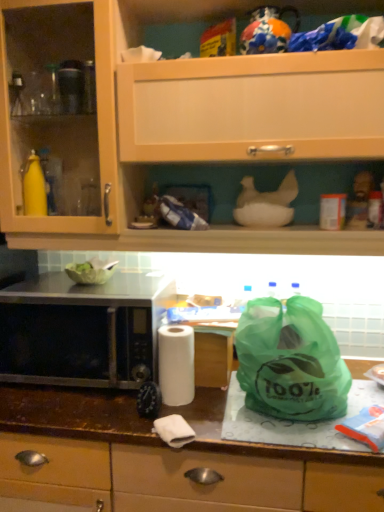
What do you see at coordinates (83, 329) in the screenshot?
I see `black matte microwave at left` at bounding box center [83, 329].

Identify the location of brown laminate countertop at center. This screenshot has height=512, width=384. (74, 415).

What do you see at coordinates (74, 415) in the screenshot? I see `brown laminate countertop at center` at bounding box center [74, 415].

The image size is (384, 512). What are the coordinates of `matte wood cabinet at upper center` in the screenshot? It's located at (183, 126).

Where is `black matte microwave at left`? Image resolution: width=384 pixels, height=512 pixels. black matte microwave at left is located at coordinates (83, 329).

In the scene shown: Is green plastic bag at right to the left of brown laminate countertop at center from the viewer's perspective?

No.

From the image's perspective, is green plastic bag at right positioned above or below brown laminate countertop at center?

Based on their image positions, green plastic bag at right is located above brown laminate countertop at center.

In the scene shown: Can brown laminate countertop at center be found inside green plastic bag at right?

No, brown laminate countertop at center is located outside of green plastic bag at right.

The image size is (384, 512). In order to click on plastic bag that is above the brown laminate countertop at center (from a real-world perspective) in this screenshot , I will do `click(290, 361)`.

In the scene shown: Is matte wood cabinet at upper center further to camera compared to white matte paper towel at center?

No, matte wood cabinet at upper center is closer to the viewer.

Can you confirm if matte wood cabinet at upper center is wider than white matte paper towel at center?

Indeed, matte wood cabinet at upper center has a greater width compared to white matte paper towel at center.

Is point (88, 37) closer to viewer compared to point (176, 361)?

No, (88, 37) is behind (176, 361).

Which of these two, brown laminate countertop at center or green plastic bag at right, is wider?

Wider between the two is brown laminate countertop at center.

Identify the location of countertop below the green plastic bag at right (from the image's perspective). (74, 415).

How far apart are brown laminate countertop at center and green plastic bag at right?

A distance of 9.55 inches exists between brown laminate countertop at center and green plastic bag at right.

Is brown laminate countertop at center facing towards green plastic bag at right?

No, brown laminate countertop at center is not turned towards green plastic bag at right.

How far apart are black matte microwave at left and white matte paper towel at center?

A distance of 8.87 inches exists between black matte microwave at left and white matte paper towel at center.

Is black matte microwave at left completely or partially outside of white matte paper towel at center?

Yes.

Can you tell me how much black matte microwave at left and white matte paper towel at center differ in facing direction?

The angle between the facing direction of black matte microwave at left and the facing direction of white matte paper towel at center is 4.79 degrees.

Looking at this image, are black matte microwave at left and white matte paper towel at center far apart?

No, there isn't a large distance between black matte microwave at left and white matte paper towel at center.

Is green plastic bag at right placed right next to matte wood cabinet at upper center?

No, green plastic bag at right is not beside matte wood cabinet at upper center.

Can you confirm if green plastic bag at right is taller than matte wood cabinet at upper center?

No.

From a real-world perspective, who is located higher, green plastic bag at right or matte wood cabinet at upper center?

matte wood cabinet at upper center.

Is green plastic bag at right at the right side of matte wood cabinet at upper center?

Yes.

Considering the sizes of objects black matte microwave at left and matte wood cabinet at upper center in the image provided, who is wider, black matte microwave at left or matte wood cabinet at upper center?

black matte microwave at left is wider.

Is black matte microwave at left positioned beyond the bounds of matte wood cabinet at upper center?

Yes, black matte microwave at left is not within matte wood cabinet at upper center.

Between black matte microwave at left and matte wood cabinet at upper center, which one has more height?

matte wood cabinet at upper center.

Which object is positioned more to the left, black matte microwave at left or brown laminate countertop at center?

From the viewer's perspective, black matte microwave at left appears more on the left side.

Does black matte microwave at left have a larger size compared to brown laminate countertop at center?

No, black matte microwave at left is not bigger than brown laminate countertop at center.

Would you say brown laminate countertop at center is part of black matte microwave at left's contents?

No, black matte microwave at left does not contain brown laminate countertop at center.

From a real-world perspective, between black matte microwave at left and brown laminate countertop at center, who is vertically lower?

brown laminate countertop at center, from a real-world perspective.

This screenshot has height=512, width=384. Find the location of `countertop in front of the green plastic bag at right`. countertop in front of the green plastic bag at right is located at coordinates (74, 415).

Locate an element on the screen. Image resolution: width=384 pixels, height=512 pixels. cabinetry positioned vertically above the white matte paper towel at center (from a real-world perspective) is located at coordinates (183, 126).

Looking at the image, which one is located closer to matte wood cabinet at upper center, white matte paper towel at center or brown laminate countertop at center?

Among the two, white matte paper towel at center is located nearer to matte wood cabinet at upper center.

Considering their positions, is matte wood cabinet at upper center positioned closer to brown laminate countertop at center than white matte paper towel at center?

Based on the image, white matte paper towel at center appears to be nearer to brown laminate countertop at center.

Based on their spatial positions, is brown laminate countertop at center or white matte paper towel at center further from black matte microwave at left?

white matte paper towel at center lies further to black matte microwave at left than the other object.

Considering their positions, is black matte microwave at left positioned further to green plastic bag at right than brown laminate countertop at center?

black matte microwave at left is further to green plastic bag at right.

In the scene shown: Estimate the real-world distances between objects in this image. Which object is closer to white matte paper towel at center, brown laminate countertop at center or black matte microwave at left?

brown laminate countertop at center is positioned closer to the anchor white matte paper towel at center.

When comparing their distances from brown laminate countertop at center, does green plastic bag at right or white matte paper towel at center seem further?

Based on the image, green plastic bag at right appears to be further to brown laminate countertop at center.

From the image, which object appears to be nearer to white matte paper towel at center, black matte microwave at left or matte wood cabinet at upper center?

black matte microwave at left.

Which object lies nearer to the anchor point matte wood cabinet at upper center, green plastic bag at right or brown laminate countertop at center?

green plastic bag at right lies closer to matte wood cabinet at upper center than the other object.

Find the location of a particular element. paper towel between green plastic bag at right and brown laminate countertop at center vertically is located at coordinates (176, 365).

Locate an element on the screen. This screenshot has height=512, width=384. paper towel between black matte microwave at left and green plastic bag at right is located at coordinates (176, 365).

You are a GUI agent. You are given a task and a screenshot of the screen. Output one action in this format:
    pyautogui.click(x=<x>, y=<y>)
    Task: Click on the paper towel between matte wood cabinet at upper center and brown laminate countertop at center from top to bottom
    This screenshot has height=512, width=384.
    Given the screenshot: What is the action you would take?
    pyautogui.click(x=176, y=365)

The image size is (384, 512). What are the coordinates of `microwave oven between matte wood cabinet at upper center and green plastic bag at right from top to bottom` in the screenshot? It's located at (83, 329).